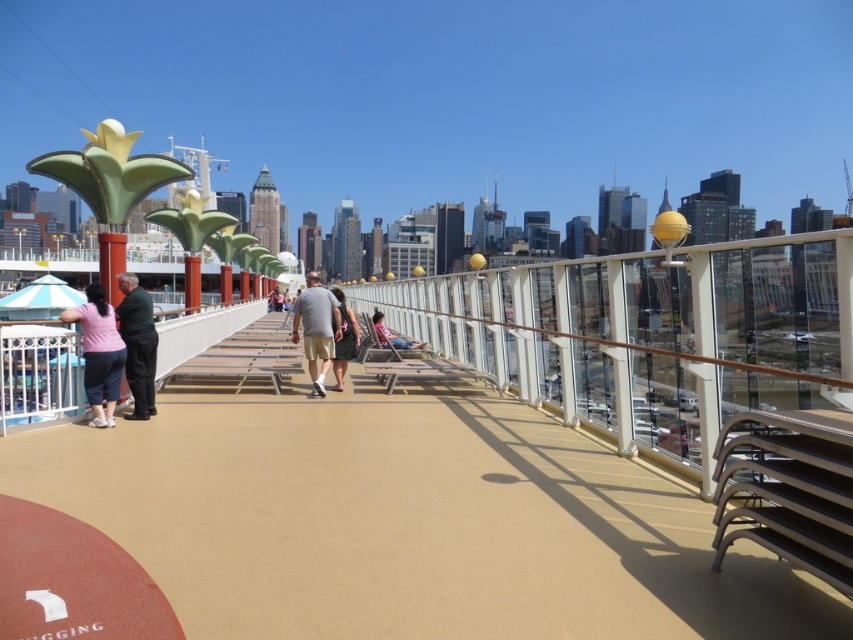
Which is more to the left, dark green fabric jacket at left or gray fabric shirt at center?

dark green fabric jacket at left

Does dark green fabric jacket at left have a smaller size compared to gray fabric shirt at center?

Indeed, dark green fabric jacket at left has a smaller size compared to gray fabric shirt at center.

Is point (140, 353) farther from viewer compared to point (328, 300)?

That is False.

This screenshot has height=640, width=853. Identify the location of dark green fabric jacket at left. (137, 344).

Find the location of a particular element. This screenshot has height=640, width=853. matte pink shirt at left is located at coordinates click(x=99, y=353).

How distant is matte pink shirt at left from dark green fabric jacket at left?

They are 11.13 inches apart.

Between point (94, 392) and point (144, 406), which one is positioned in front?

Point (94, 392) is in front.

Where is `matte pink shirt at left`? matte pink shirt at left is located at coordinates (99, 353).

Between beige rubber deck at center and pink fabric chair at center, which one has less height?

beige rubber deck at center is shorter.

Between beige rubber deck at center and pink fabric chair at center, which one is positioned higher?

pink fabric chair at center

Which is in front, point (201, 448) or point (379, 342)?

Point (201, 448)

Locate an element on the screen. beige rubber deck at center is located at coordinates (405, 522).